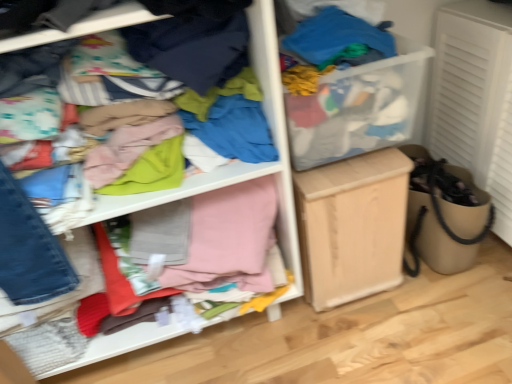
Question: In the image, is light wood cabinet at center on the left side or the right side of cloth at left?

Choices:
 (A) right
 (B) left

Answer: (A)

Question: From a real-world perspective, relative to cloth at left, is light wood cabinet at center vertically above or below?

Choices:
 (A) above
 (B) below

Answer: (B)

Question: Based on their sizes in the image, would you say light wood cabinet at center is bigger or smaller than cloth at left?

Choices:
 (A) small
 (B) big

Answer: (A)

Question: Which is correct: cloth at left is inside light wood cabinet at center, or outside of it?

Choices:
 (A) inside
 (B) outside

Answer: (B)

Question: Is cloth at left in front of or behind light wood cabinet at center in the image?

Choices:
 (A) behind
 (B) front

Answer: (B)

Question: Considering the positions of cloth at left and light wood cabinet at center in the image, is cloth at left taller or shorter than light wood cabinet at center?

Choices:
 (A) tall
 (B) short

Answer: (A)

Question: In terms of size, does cloth at left appear bigger or smaller than light wood cabinet at center?

Choices:
 (A) small
 (B) big

Answer: (B)